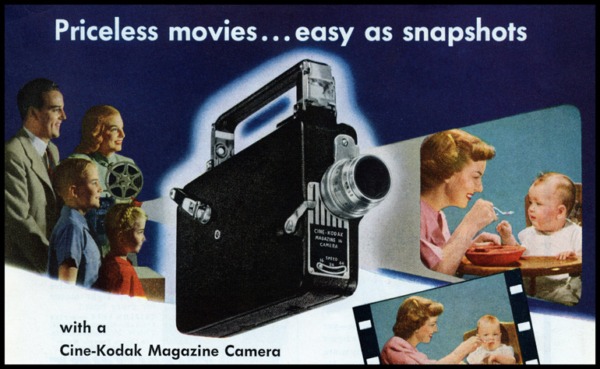
Identify the location of highchair tray. (533, 264).